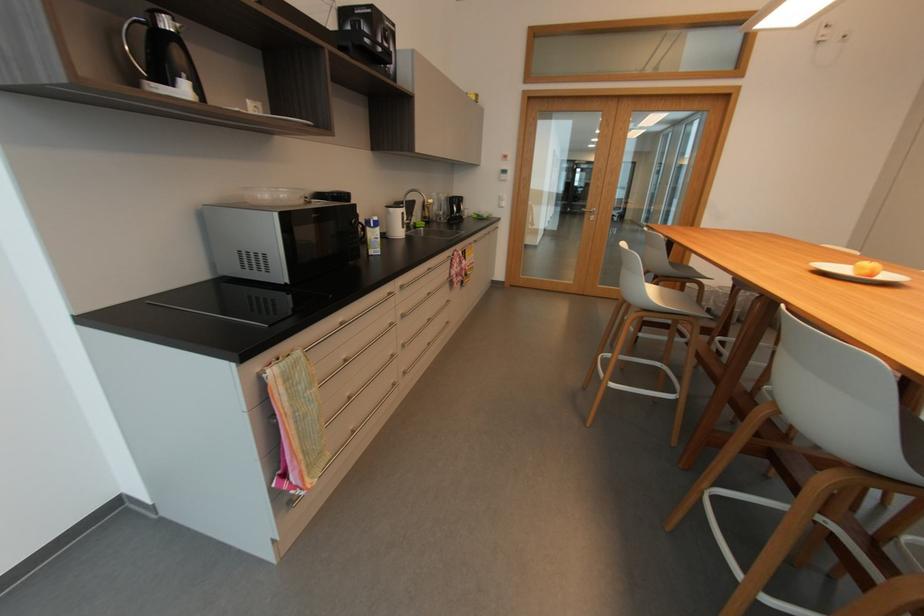
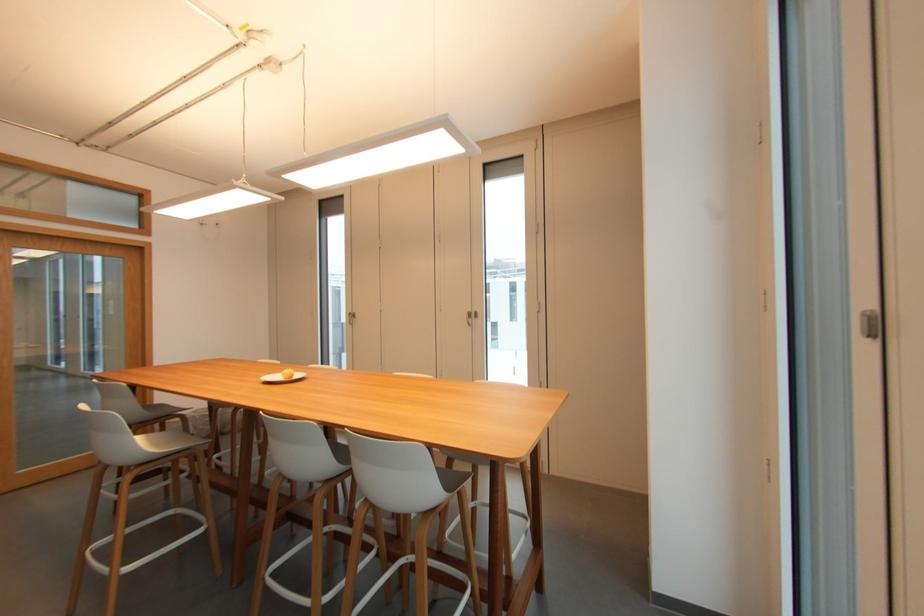
Question: How did the camera likely rotate?

Choices:
 (A) Left
 (B) Right
 (C) Up
 (D) Down

Answer: (B)